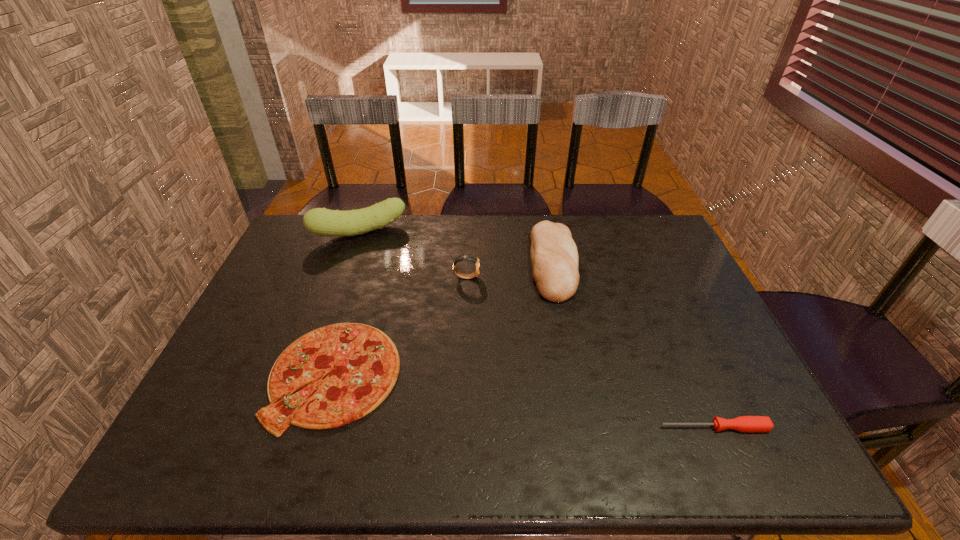
Identify the location of object located at the near left corner. This screenshot has width=960, height=540. (362, 363).

Image resolution: width=960 pixels, height=540 pixels. What are the coordinates of `object that is at the near right corner` in the screenshot? It's located at (742, 423).

The width and height of the screenshot is (960, 540). What are the coordinates of `vacant space at the far edge of the desktop` in the screenshot? It's located at (526, 226).

In the image, there is a desktop. Identify the location of free space at the near edge. The width and height of the screenshot is (960, 540). (473, 444).

Locate an element on the screen. The width and height of the screenshot is (960, 540). vacant region at the left edge is located at coordinates (254, 299).

Image resolution: width=960 pixels, height=540 pixels. In the image, there is a desktop. What are the coordinates of `vacant space at the right edge` in the screenshot? It's located at (694, 308).

You are a GUI agent. You are given a task and a screenshot of the screen. Output one action in this format:
    pyautogui.click(x=<x>, y=<y>)
    Task: Click on the free spot between the tallest object and the rightmost object
    The image size is (960, 540).
    Given the screenshot: What is the action you would take?
    pyautogui.click(x=537, y=330)

You are a GUI agent. You are given a task and a screenshot of the screen. Output one action in this format:
    pyautogui.click(x=<x>, y=<y>)
    Task: Click on the blank region between the bread and the watch
    
    Given the screenshot: What is the action you would take?
    pyautogui.click(x=510, y=270)

Locate an element on the screen. The image size is (960, 540). vacant region between the cucumber and the pizza is located at coordinates (348, 304).

I want to click on free space between the rightmost object and the second object from right to left, so click(x=634, y=346).